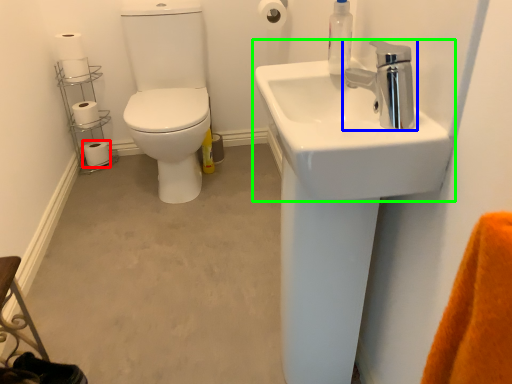
Question: Which is farther away from toilet paper (highlighted by a red box)? tap (highlighted by a blue box) or sink (highlighted by a green box)?

Choices:
 (A) tap
 (B) sink

Answer: (A)